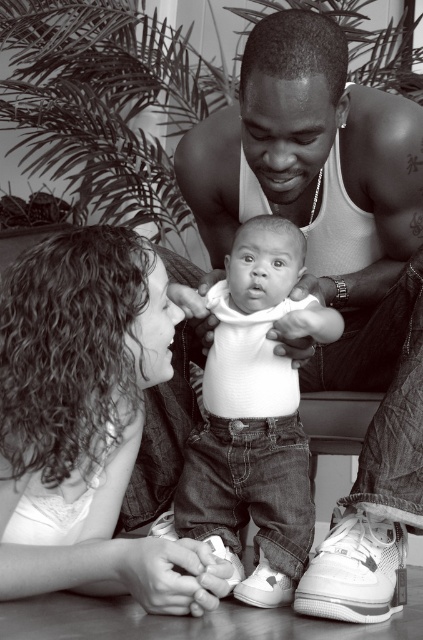
Based on the photo, you are a photographer taking a picture of the curly hair at center and the white soft fabric baby at center. If your camera has a minimum focusing distance of 10 inches, will you need to adjust your position to ensure both subjects are in focus?

The distance between the curly hair at center and the white soft fabric baby at center is 9.28 inches. Since this is less than the camera minimum focusing distance of 10 inches, you need to move further away to ensure both subjects are in focus.

You are a photographer trying to capture a closeup of the baby in the scene. Given that the camera can only focus on objects within a 20cm radius, and knowing the size difference between the curly hair at center and the white soft fabric baby at center, which object should you focus on to ensure the baby is in focus?

The curly hair at center is bigger than the white soft fabric baby at center, so focusing on the curly hair at center would ensure the baby is within the 20cm radius and in focus.

Based on the scene description, where exactly is the curly hair at center located in the image?

The curly hair at center is located at point (x=87, y=422).